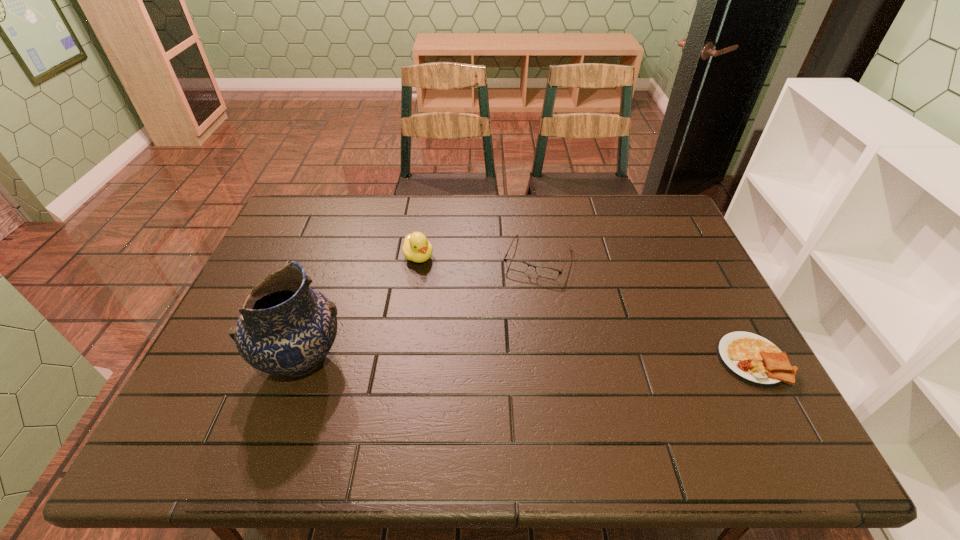
Locate an element on the screen. This screenshot has width=960, height=540. object located at the near left corner is located at coordinates (285, 328).

This screenshot has height=540, width=960. I want to click on object present at the near right corner, so click(751, 358).

The height and width of the screenshot is (540, 960). I want to click on free point at the far edge, so click(518, 232).

Locate an element on the screen. Image resolution: width=960 pixels, height=540 pixels. vacant space at the near edge of the desktop is located at coordinates (531, 388).

Identify the location of vacant space at the right edge of the desktop. This screenshot has height=540, width=960. (660, 244).

The height and width of the screenshot is (540, 960). In order to click on vacant region at the far left corner of the desktop in this screenshot , I will do `click(293, 231)`.

This screenshot has width=960, height=540. I want to click on free spot at the near right corner of the desktop, so click(x=757, y=389).

The height and width of the screenshot is (540, 960). Find the location of `empty location between the pottery and the spectacles`. empty location between the pottery and the spectacles is located at coordinates (420, 309).

You are a GUI agent. You are given a task and a screenshot of the screen. Output one action in this format:
    pyautogui.click(x=<x>, y=<y>)
    Task: Click on the vacant space that's between the second tallest object and the rightmost object
    The height and width of the screenshot is (540, 960).
    Given the screenshot: What is the action you would take?
    pyautogui.click(x=586, y=308)

The width and height of the screenshot is (960, 540). What are the coordinates of `free space between the leftmost object and the rightmost object` in the screenshot? It's located at (527, 360).